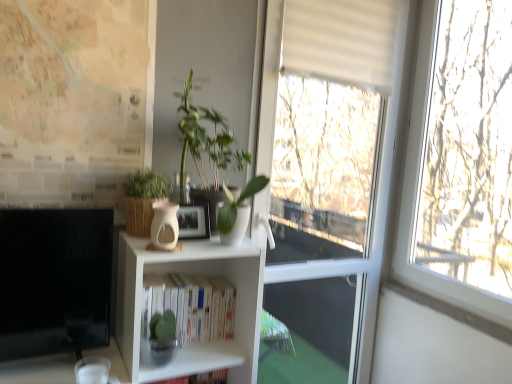
Question: Is white matte bookshelf at center inside or outside of green leafy plant at center, which is the first plant from left to right?

Choices:
 (A) inside
 (B) outside

Answer: (B)

Question: In the image, is white matte bookshelf at center positioned in front of or behind green leafy plant at center, arranged as the second plant when viewed from the right?

Choices:
 (A) front
 (B) behind

Answer: (B)

Question: Which object is the closest to the white matte bookshelf at center?

Choices:
 (A) white glossy vase at center, which is the second plant in left-to-right order
 (B) green leafy plant at center, which is the first plant from left to right
 (C) matte beige vase at center
 (D) map paper at left
 (E) white matte window at center

Answer: (C)

Question: Estimate the real-world distances between objects in this image. Which object is closer to the white matte bookshelf at center?

Choices:
 (A) green leafy plant at center, which is the first plant from left to right
 (B) brown woven basket at center, placed as the 1th houseplant when sorted from left to right
 (C) white glossy vase at center, which is the second plant in left-to-right order
 (D) green glossy plant at center, which appears as the second houseplant when viewed from the left
 (E) matte beige vase at center

Answer: (E)